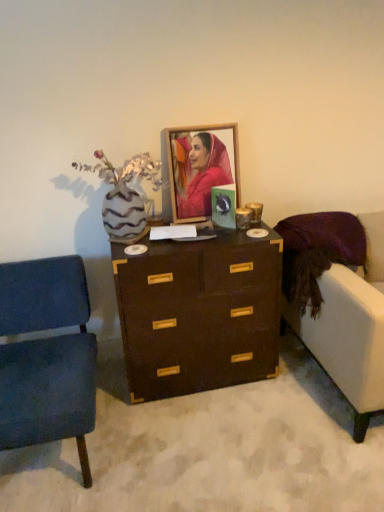
Question: Is velvet blue chair at left positioned far away from brown wood chest of drawers at center?

Choices:
 (A) no
 (B) yes

Answer: (A)

Question: From the image's perspective, is velvet blue chair at left located beneath brown wood chest of drawers at center?

Choices:
 (A) no
 (B) yes

Answer: (B)

Question: Considering the relative sizes of velvet blue chair at left and brown wood chest of drawers at center in the image provided, is velvet blue chair at left thinner than brown wood chest of drawers at center?

Choices:
 (A) yes
 (B) no

Answer: (B)

Question: Is velvet blue chair at left to the right of brown wood chest of drawers at center from the viewer's perspective?

Choices:
 (A) yes
 (B) no

Answer: (B)

Question: Is velvet blue chair at left not inside brown wood chest of drawers at center?

Choices:
 (A) no
 (B) yes

Answer: (B)

Question: Is zebra-patterned vase with dried flowers at left inside or outside of brown wood chest of drawers at center?

Choices:
 (A) outside
 (B) inside

Answer: (A)

Question: Is zebra-patterned vase with dried flowers at left wider or thinner than brown wood chest of drawers at center?

Choices:
 (A) wide
 (B) thin

Answer: (B)

Question: Considering the positions of zebra-patterned vase with dried flowers at left and brown wood chest of drawers at center in the image, is zebra-patterned vase with dried flowers at left bigger or smaller than brown wood chest of drawers at center?

Choices:
 (A) small
 (B) big

Answer: (A)

Question: From a real-world perspective, relative to brown wood chest of drawers at center, is zebra-patterned vase with dried flowers at left vertically above or below?

Choices:
 (A) below
 (B) above

Answer: (B)

Question: Is matte wooden picture frame at center in front of or behind brown wood chest of drawers at center in the image?

Choices:
 (A) behind
 (B) front

Answer: (A)

Question: In terms of width, does matte wooden picture frame at center look wider or thinner when compared to brown wood chest of drawers at center?

Choices:
 (A) wide
 (B) thin

Answer: (B)

Question: Is point (226, 170) closer or farther from the camera than point (205, 330)?

Choices:
 (A) closer
 (B) farther

Answer: (B)

Question: Looking at the image, does matte wooden picture frame at center seem bigger or smaller compared to brown wood chest of drawers at center?

Choices:
 (A) small
 (B) big

Answer: (A)

Question: Considering their positions, is matte wooden picture frame at center located in front of or behind velvet blue chair at left?

Choices:
 (A) front
 (B) behind

Answer: (B)

Question: In the image, is matte wooden picture frame at center on the left side or the right side of velvet blue chair at left?

Choices:
 (A) left
 (B) right

Answer: (B)